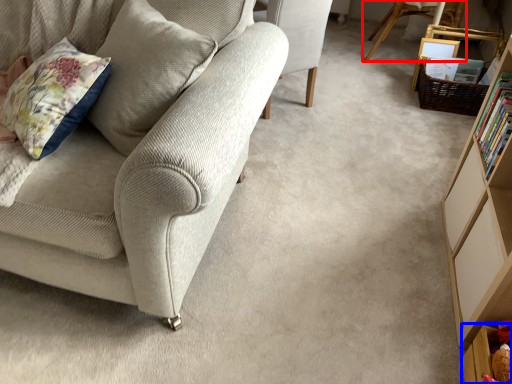
Question: Which object is further to the camera taking this photo, chair (highlighted by a red box) or shelf (highlighted by a blue box)?

Choices:
 (A) chair
 (B) shelf

Answer: (A)